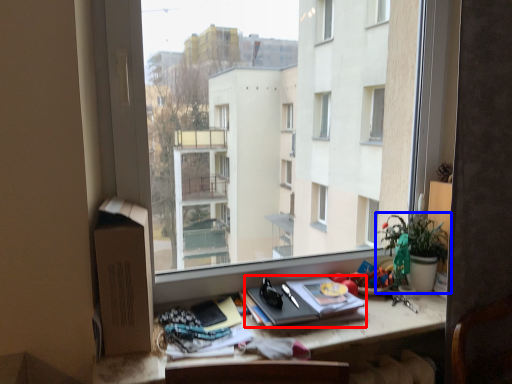
Question: Which point is further to the camera, paperback book (highlighted by a red box) or houseplant (highlighted by a blue box)?

Choices:
 (A) paperback book
 (B) houseplant

Answer: (B)